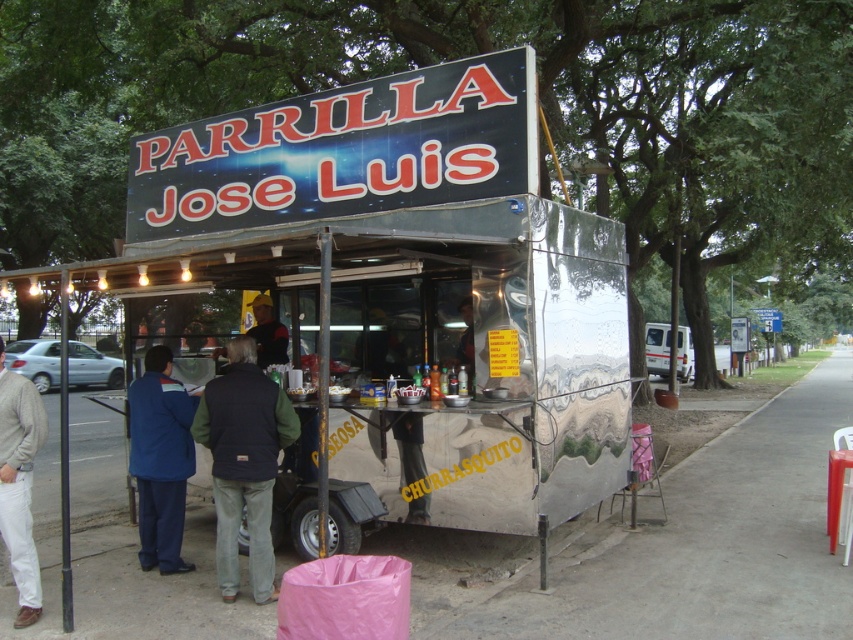
Question: Considering the relative positions of shiny metallic food truck at center and metallic pavement at lower center in the image provided, where is shiny metallic food truck at center located with respect to metallic pavement at lower center?

Choices:
 (A) below
 (B) above

Answer: (B)

Question: Which of the following is the farthest from the observer?

Choices:
 (A) blue fabric jacket at left
 (B) white cotton pants at lower left
 (C) shiny metallic food truck at center

Answer: (A)

Question: In this image, where is dark blue vest at center located relative to blue fabric jacket at left?

Choices:
 (A) left
 (B) right

Answer: (B)

Question: Which point appears closest to the camera in this image?

Choices:
 (A) (793, 394)
 (B) (160, 490)

Answer: (B)

Question: Among these points, which one is farthest from the camera?

Choices:
 (A) (132, 440)
 (B) (210, 557)

Answer: (B)

Question: Is blue fabric jacket at left bigger than dark blue shirt at center?

Choices:
 (A) yes
 (B) no

Answer: (B)